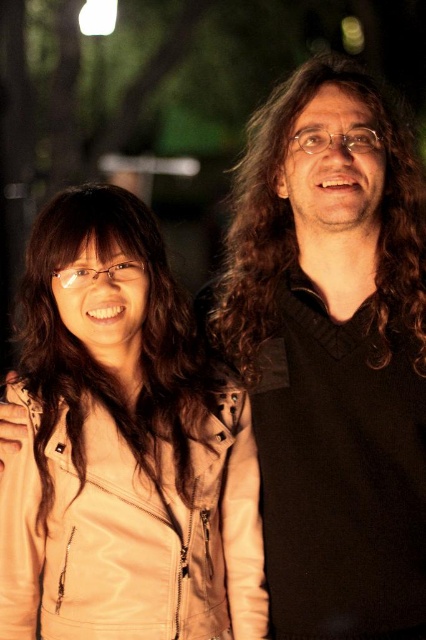
Question: Which of the following is the closest to the observer?

Choices:
 (A) black matte sweater at right
 (B) tan leather jacket at left

Answer: (B)

Question: Can you confirm if black matte sweater at right is thinner than tan leather jacket at left?

Choices:
 (A) no
 (B) yes

Answer: (B)

Question: Which point is closer to the camera?

Choices:
 (A) tan leather jacket at left
 (B) black matte sweater at right

Answer: (A)

Question: Does black matte sweater at right appear on the left side of tan leather jacket at left?

Choices:
 (A) yes
 (B) no

Answer: (B)

Question: Is black matte sweater at right above tan leather jacket at left?

Choices:
 (A) yes
 (B) no

Answer: (A)

Question: Which object appears farthest from the camera in this image?

Choices:
 (A) tan leather jacket at left
 (B) black matte sweater at right

Answer: (B)